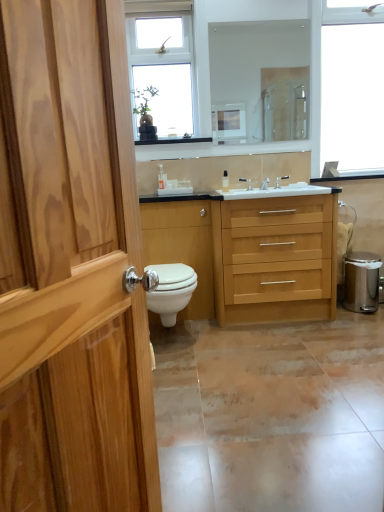
Identify the location of vacant space in front of light wood/woodenobject at center. (286, 343).